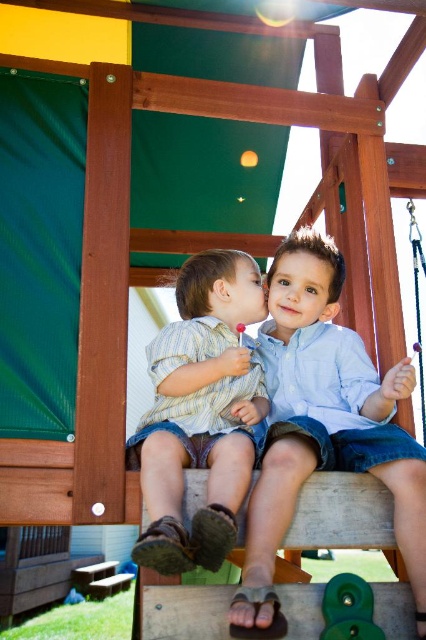
From the picture: You are a photographer standing at the base of the play structure. You want to take a photo of the light blue denim shorts at center. Which direction should you look to capture them in your shot?

The light blue denim shorts at center are located at point 0.667 on the x axis and 0.758 on the y axis, so you should look to the upper right direction to capture them in your shot.

You are a photographer taking a picture of the striped cotton shirt at center and the green rubber toy at lower center. Which object will appear larger in the photo?

The striped cotton shirt at center will appear larger in the photo because it is much taller than the green rubber toy at lower center.